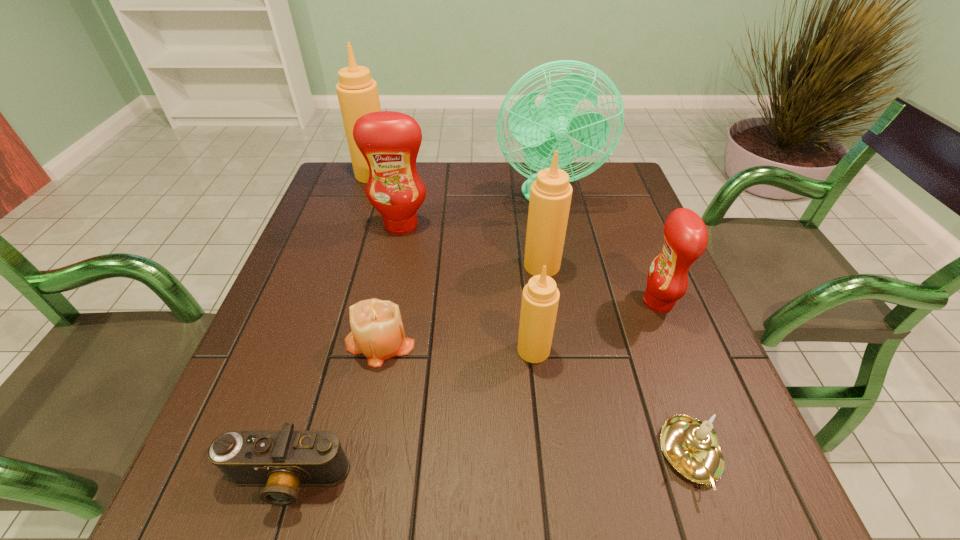
The width and height of the screenshot is (960, 540). Find the location of `blue fan`. blue fan is located at coordinates (546, 128).

Image resolution: width=960 pixels, height=540 pixels. In order to click on the biggest tan condiment in this screenshot , I will do `click(357, 92)`.

Find the location of `the farthest condiment`. the farthest condiment is located at coordinates (357, 92).

Where is `the farther red condiment`? Image resolution: width=960 pixels, height=540 pixels. the farther red condiment is located at coordinates (390, 141).

Where is `the fourth nearest condiment`? the fourth nearest condiment is located at coordinates (390, 141).

The image size is (960, 540). Find the location of `the second nearest tan condiment`. the second nearest tan condiment is located at coordinates (550, 195).

At what (x,y) coordinates should I click in order to perform the action: click on the second smallest tan condiment. Please return your answer as a coordinate pair (x, y). The width and height of the screenshot is (960, 540). Looking at the image, I should click on (550, 195).

You are a GUI agent. You are given a task and a screenshot of the screen. Output one action in this format:
    pyautogui.click(x=<x>, y=<y>)
    Task: Click on the nearest condiment
    The image size is (960, 540).
    Given the screenshot: What is the action you would take?
    pyautogui.click(x=540, y=297)

The width and height of the screenshot is (960, 540). Identify the location of the smallest tan condiment. (540, 297).

Image resolution: width=960 pixels, height=540 pixels. Find the location of `the fourth farthest condiment`. the fourth farthest condiment is located at coordinates (685, 234).